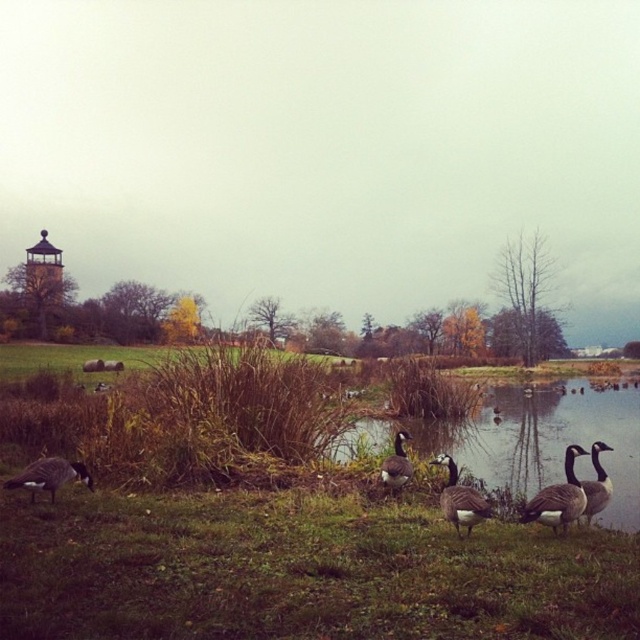
You are a photographer trying to capture the smooth reflective water at center and the gray matte duck at lower right in a single shot. Given their sizes, which object will occupy more space in your photo?

The smooth reflective water at center will occupy more space in the photo because it has a larger size compared to the gray matte duck at lower right.